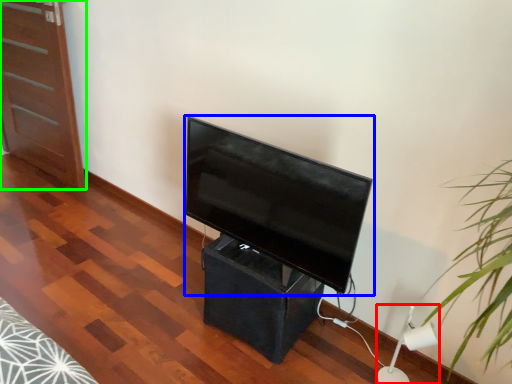
Question: Considering the real-world distances, which object is farthest from lamp (highlighted by a red box)? television (highlighted by a blue box) or furniture (highlighted by a green box)?

Choices:
 (A) television
 (B) furniture

Answer: (B)